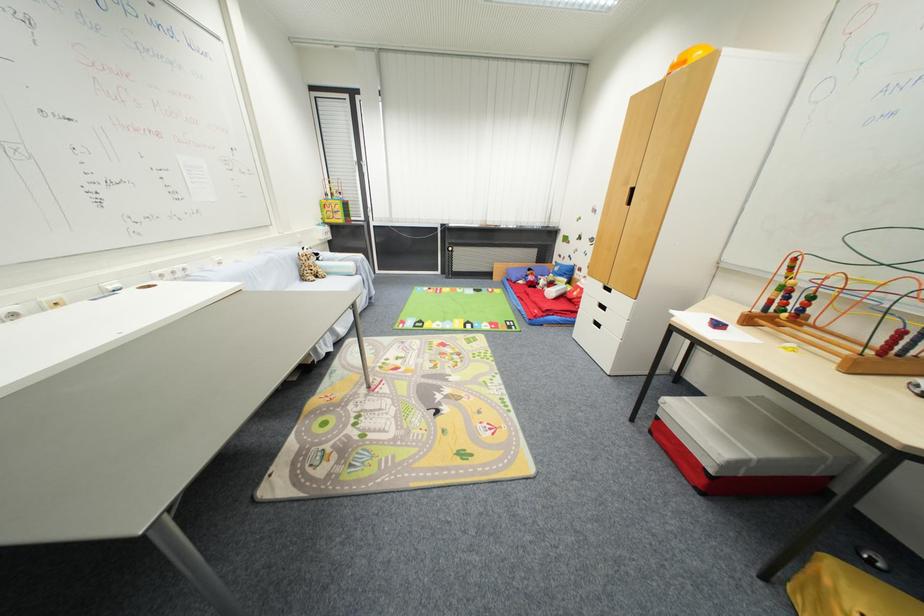
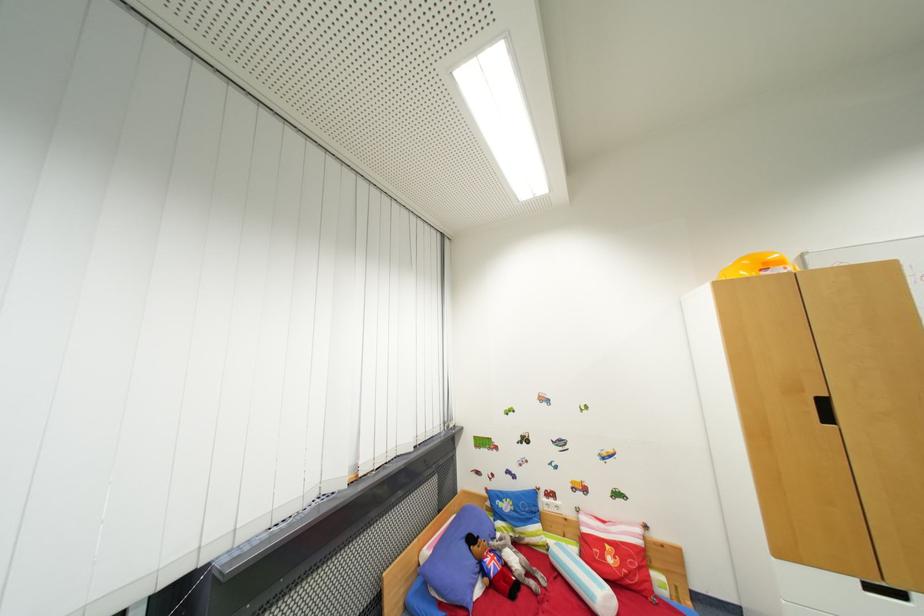
In the second image, find the point that corresponds to pixel 580 294 in the first image.

(614, 562)